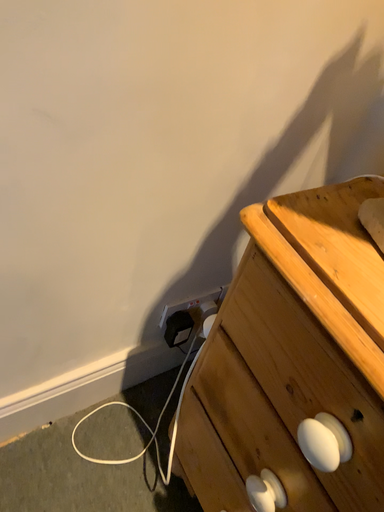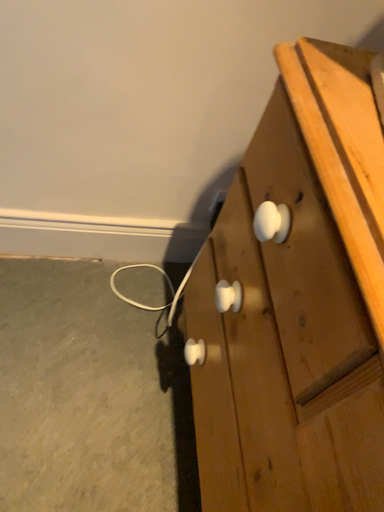
Question: How did the camera likely rotate when shooting the video?

Choices:
 (A) rotated left
 (B) rotated right

Answer: (A)